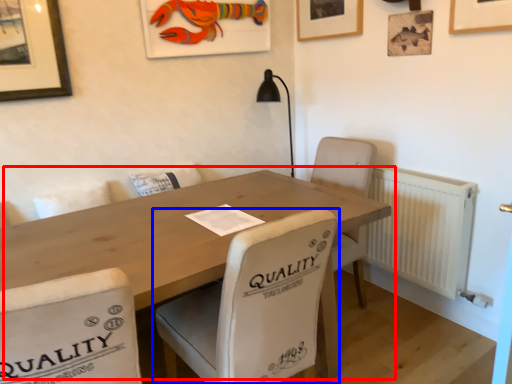
Question: Which of the following is the closest to the observer, table (highlighted by a red box) or chair (highlighted by a blue box)?

Choices:
 (A) table
 (B) chair

Answer: (A)